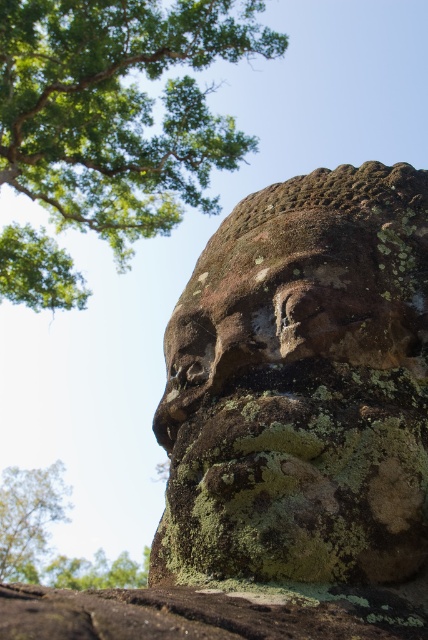
You are an archaeologist examining the image of an ancient stone sculpture. You notice two objects at the upper left corner of the frame. Which one is bigger between the green mossy rock at upper left and the green mossy tree at upper left?

The green mossy rock at upper left is larger in size than the green mossy tree at upper left.

Based on the photo, you are an archaeologist examining the ancient stone sculpture. You notice the green mossy stone face at center and the green mossy rock at upper left. Which object is located higher in the image?

The green mossy rock at upper left is higher in the image than the green mossy stone face at center.